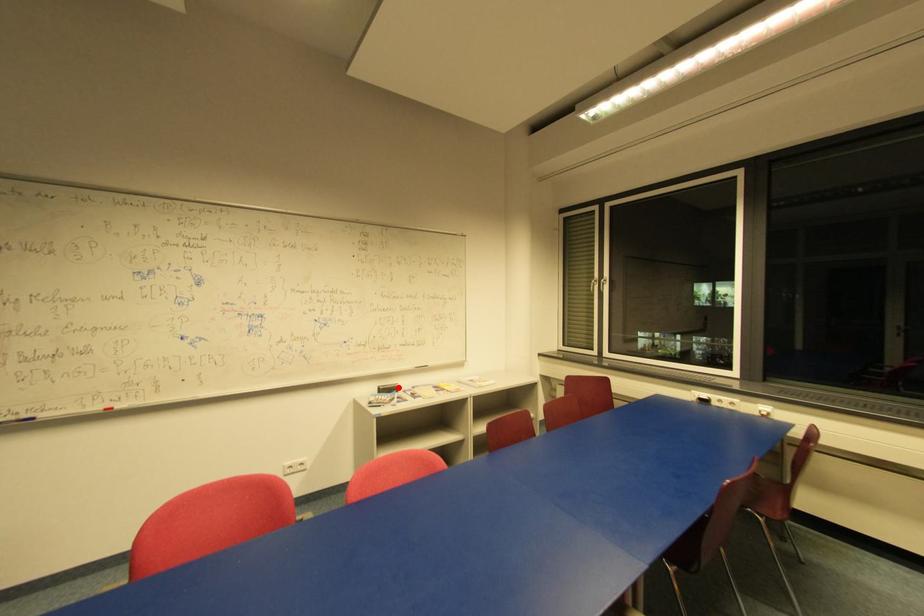
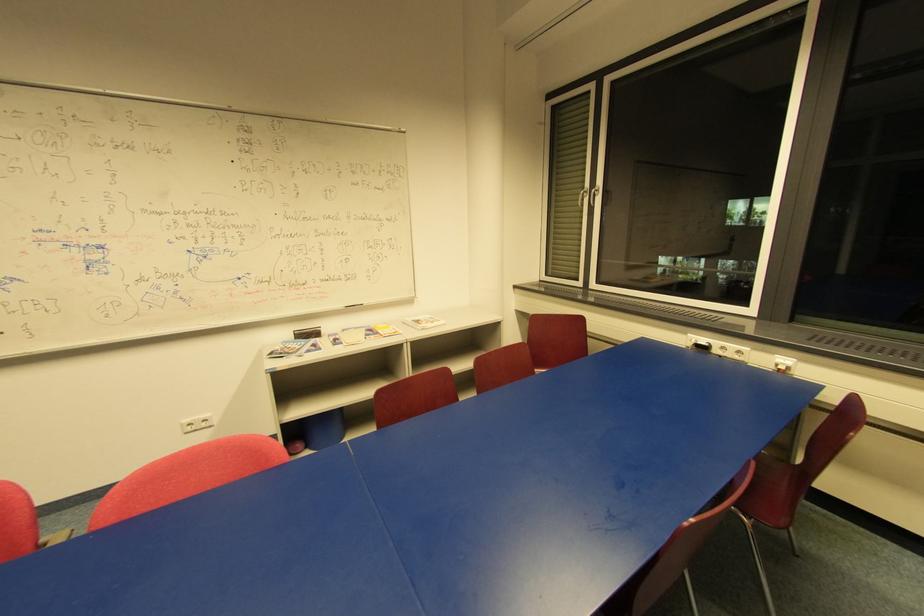
Question: I am providing you with two images of the same scene from different viewpoints. In image1, a red point is highlighted. Considering the same 3D point in image2, which of the following is correct?

Choices:
 (A) It is closer
 (B) It is farther

Answer: (A)